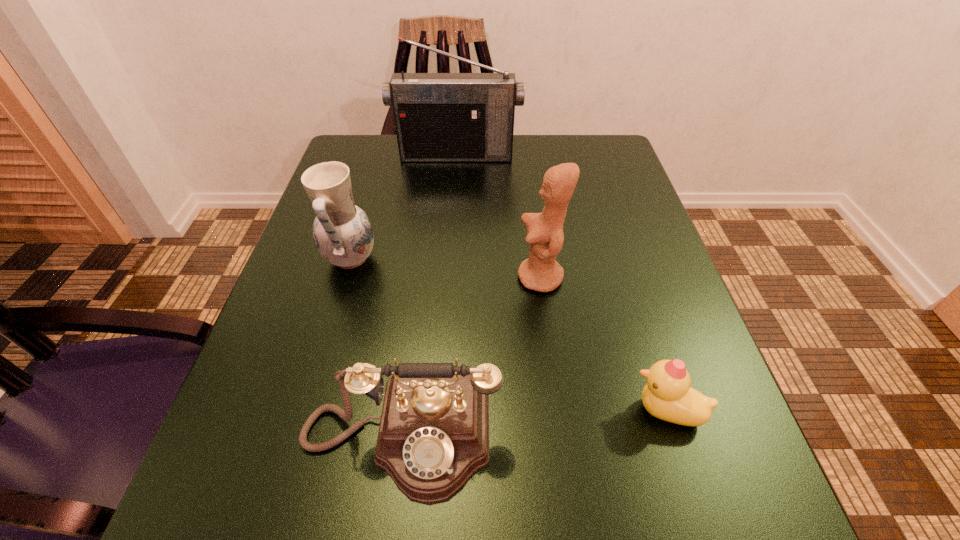
This screenshot has width=960, height=540. I want to click on free location that satisfies the following two spatial constraints: 1. on the front-facing side of the duckling; 2. on the dial of the telephone, so click(x=675, y=437).

This screenshot has height=540, width=960. Find the location of `vacant region that satisfies the following two spatial constraints: 1. on the front-facing side of the fourth shortest object; 2. on the dial of the second shortest object`. vacant region that satisfies the following two spatial constraints: 1. on the front-facing side of the fourth shortest object; 2. on the dial of the second shortest object is located at coordinates (562, 437).